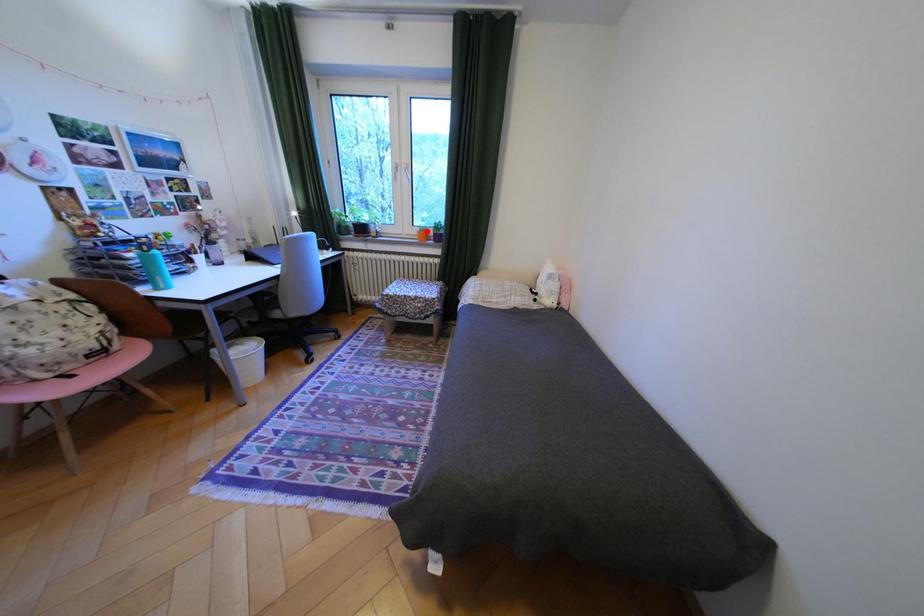
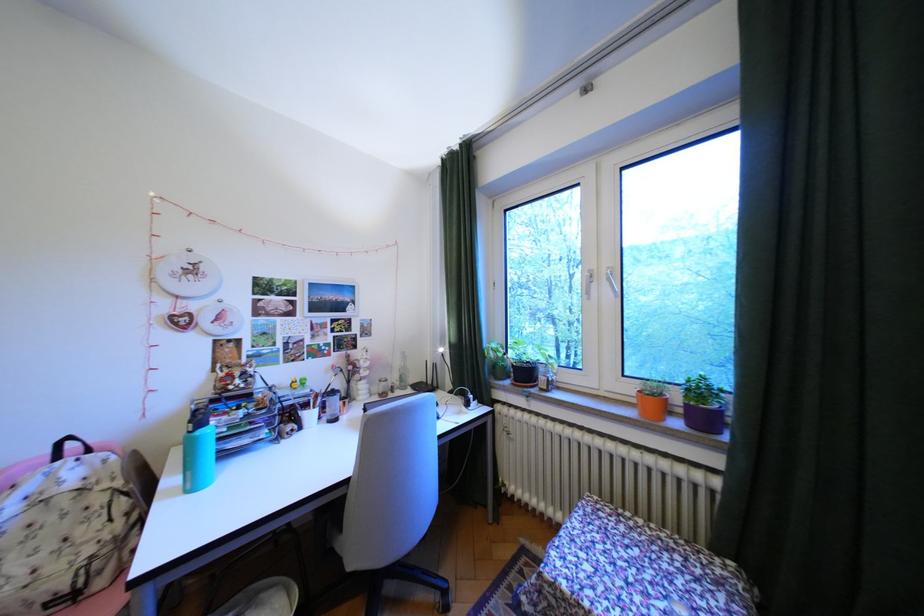
Locate, in the second image, the point that corresponds to the highlighted location in the first image.

(641, 390)